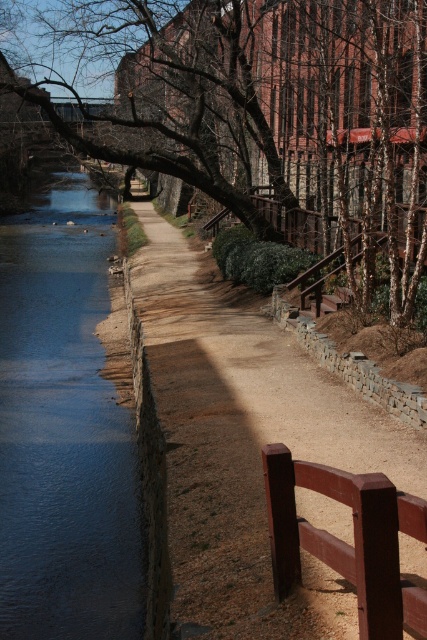
Can you confirm if bare branches at upper center is thinner than brown gravel path at center?

No, bare branches at upper center is not thinner than brown gravel path at center.

Between bare branches at upper center and brown gravel path at center, which one is positioned lower?

brown gravel path at center

Between point (328, 77) and point (245, 404), which one is positioned in front?

Point (245, 404)

The image size is (427, 640). Identify the location of bare branches at upper center. (259, 109).

Which is above, brown gravel path at center or blue smooth water at left?

blue smooth water at left

Does brown gravel path at center have a lesser height compared to blue smooth water at left?

Correct, brown gravel path at center is not as tall as blue smooth water at left.

Is point (368, 461) behind point (25, 289)?

No, it is in front of (25, 289).

You are a GUI agent. You are given a task and a screenshot of the screen. Output one action in this format:
    pyautogui.click(x=<x>, y=<y>)
    Task: Click on the brown gravel path at center
    
    Given the screenshot: What is the action you would take?
    pyautogui.click(x=245, y=448)

Is bare branches at upper center wider than blue smooth water at left?

Indeed, bare branches at upper center has a greater width compared to blue smooth water at left.

Which is more to the right, bare branches at upper center or blue smooth water at left?

Positioned to the right is bare branches at upper center.

Who is more forward, (239, 140) or (8, 449)?

Point (8, 449) is in front.

At what (x,y) coordinates should I click in order to perform the action: click on bare branches at upper center. Please return your answer as a coordinate pair (x, y). This screenshot has width=427, height=640. Looking at the image, I should click on (259, 109).